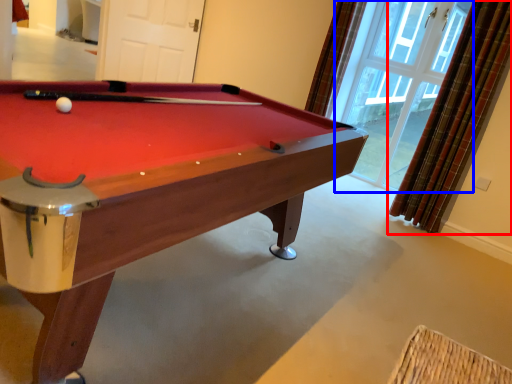
Question: Which object is further to the camera taking this photo, curtain (highlighted by a red box) or window (highlighted by a blue box)?

Choices:
 (A) curtain
 (B) window

Answer: (B)